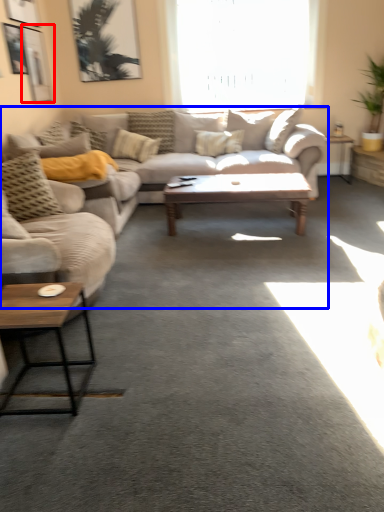
Question: Which point is closer to the camera, picture frame (highlighted by a red box) or studio couch (highlighted by a blue box)?

Choices:
 (A) picture frame
 (B) studio couch

Answer: (B)